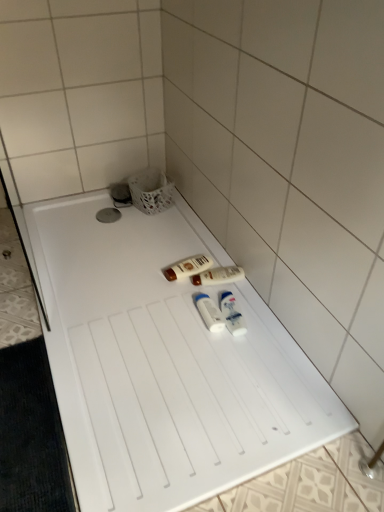
Identify the location of vacant space that is to the left of white glossy lotion at center, acting as the second toiletry starting from the back. This screenshot has width=384, height=512. (165, 286).